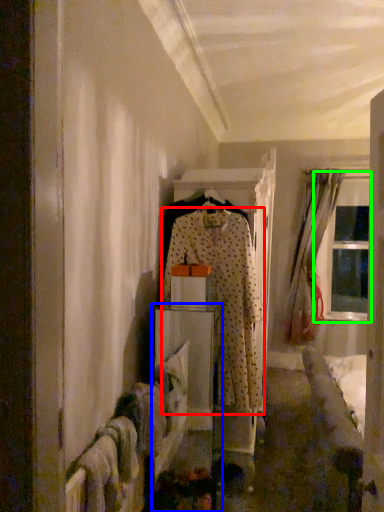
Question: Considering the real-world distances, which object is closest to fancy dress (highlighted by a red box)? furniture (highlighted by a blue box) or window (highlighted by a green box).

Choices:
 (A) furniture
 (B) window

Answer: (A)